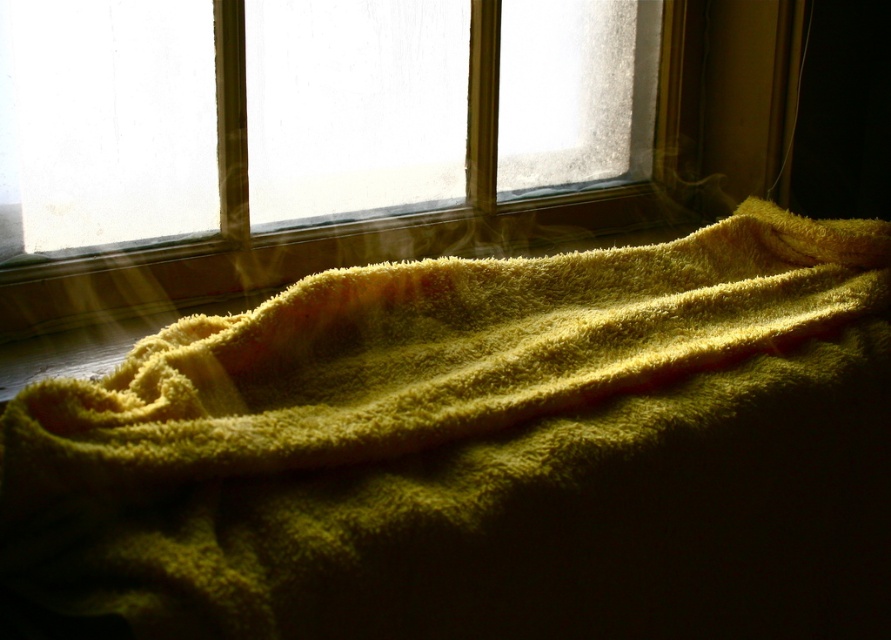
Question: Does yellow fuzzy towel at center appear on the left side of translucent glass window at upper center?

Choices:
 (A) yes
 (B) no

Answer: (B)

Question: Can you confirm if yellow fuzzy towel at center is positioned below translucent glass window at upper center?

Choices:
 (A) no
 (B) yes

Answer: (B)

Question: Does yellow fuzzy towel at center lie in front of translucent glass window at upper center?

Choices:
 (A) no
 (B) yes

Answer: (B)